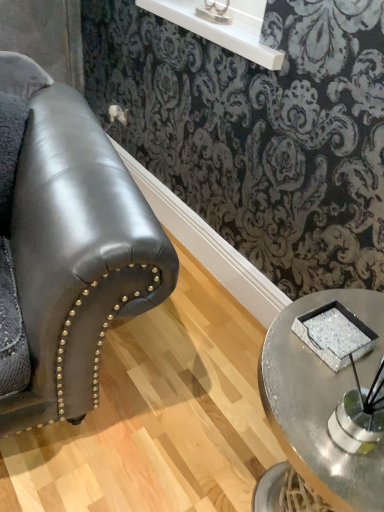
Image resolution: width=384 pixels, height=512 pixels. I want to click on free location to the left of metallic silver tray at lower right, so click(x=287, y=406).